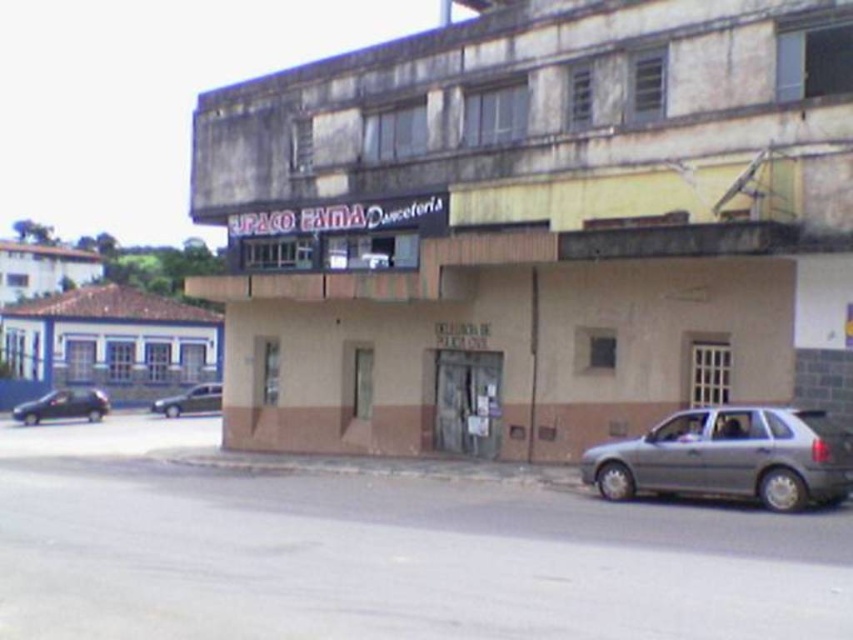
Question: Among these points, which one is nearest to the camera?

Choices:
 (A) (93, 412)
 (B) (651, 468)

Answer: (B)

Question: Is shiny black sedan at lower left further to the viewer compared to metallic silver sedan at lower left?

Choices:
 (A) yes
 (B) no

Answer: (B)

Question: Can you confirm if satin silver hatchback at lower right is positioned below shiny black sedan at lower left?

Choices:
 (A) no
 (B) yes

Answer: (A)

Question: Which point is farther to the camera?

Choices:
 (A) (88, 419)
 (B) (624, 477)

Answer: (A)

Question: In this image, where is shiny black sedan at lower left located relative to metallic silver sedan at lower left?

Choices:
 (A) above
 (B) below

Answer: (A)

Question: Among these objects, which one is farthest from the camera?

Choices:
 (A) shiny black sedan at lower left
 (B) satin silver hatchback at lower right
 (C) metallic silver sedan at lower left

Answer: (C)